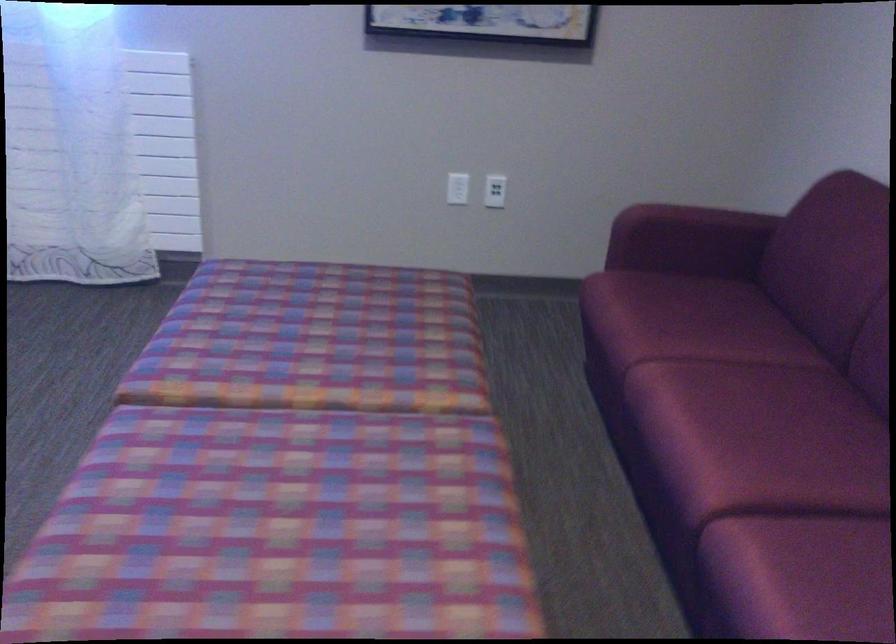
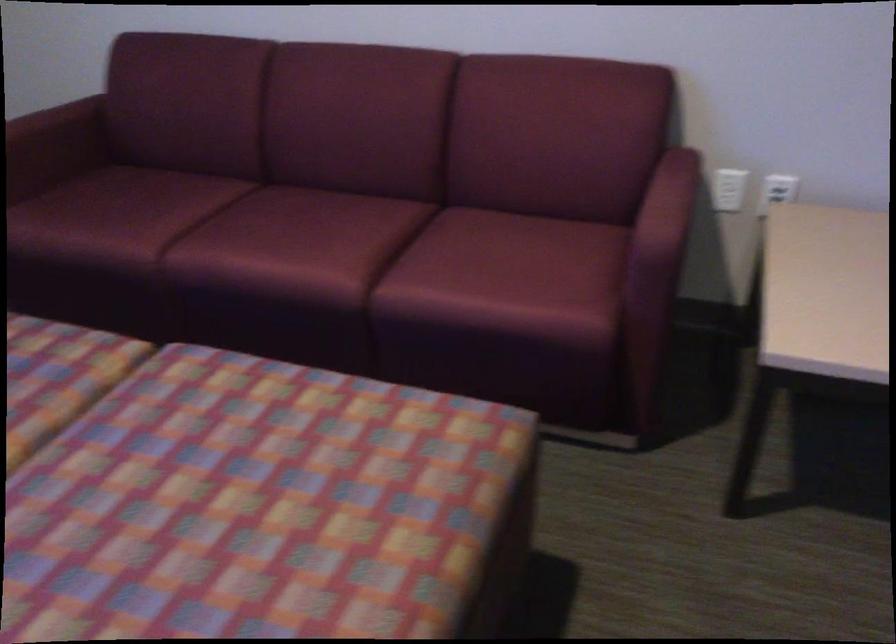
Find the pixel in the second image that matches point 695,245 in the first image.

(55, 147)